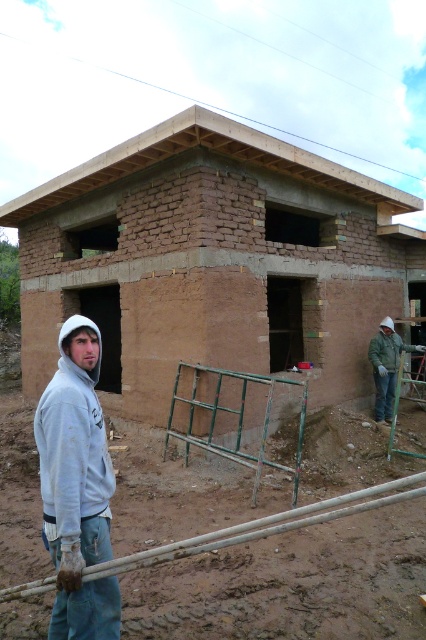
Is gray hoodie at left to the left of white matte construction worker at right from the viewer's perspective?

Indeed, gray hoodie at left is positioned on the left side of white matte construction worker at right.

Is gray hoodie at left shorter than white matte construction worker at right?

No.

Who is more forward, (51, 528) or (388, 346)?

Point (51, 528) is more forward.

Find the location of a particular element. This screenshot has width=426, height=640. gray hoodie at left is located at coordinates (77, 486).

Is point (229, 310) more distant than point (379, 381)?

No, it is not.

Is the position of brown mud hut at center less distant than that of white matte construction worker at right?

Yes, it is.

What are the coordinates of `brown mud hut at center` in the screenshot? It's located at (212, 259).

Does brown mud hut at center have a lesser width compared to gray hoodie at left?

No.

Which is behind, point (158, 202) or point (60, 616)?

Point (158, 202)

Where is `brown mud hut at center`? The image size is (426, 640). brown mud hut at center is located at coordinates (212, 259).